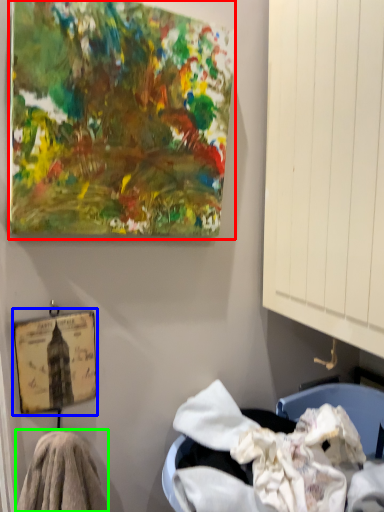
Question: Which object is the farthest from oil painting (highlighted by a red box)? Choose among these: picture frame (highlighted by a blue box) or material (highlighted by a green box).

Choices:
 (A) picture frame
 (B) material

Answer: (B)